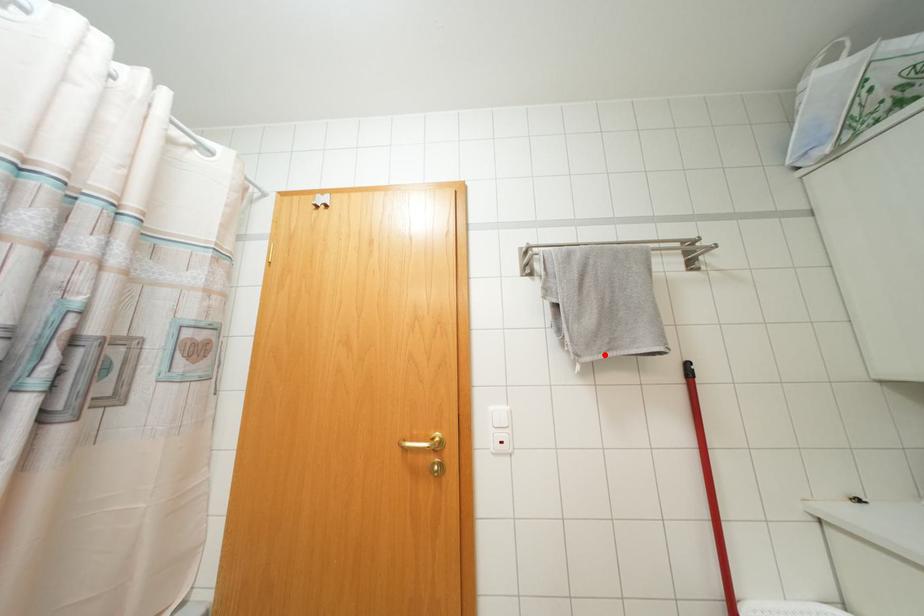
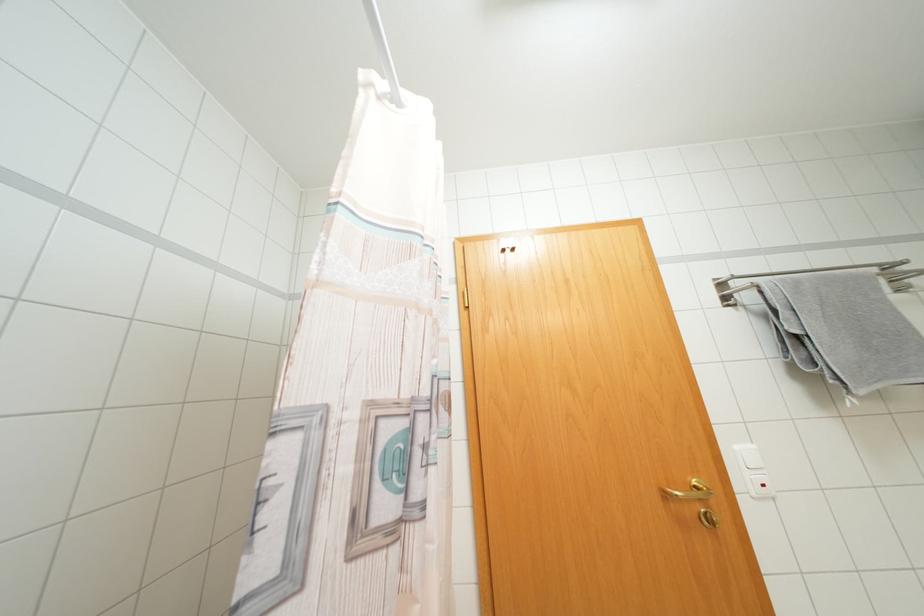
Find the pixel in the second image that matches the highlighted location in the first image.

(877, 386)